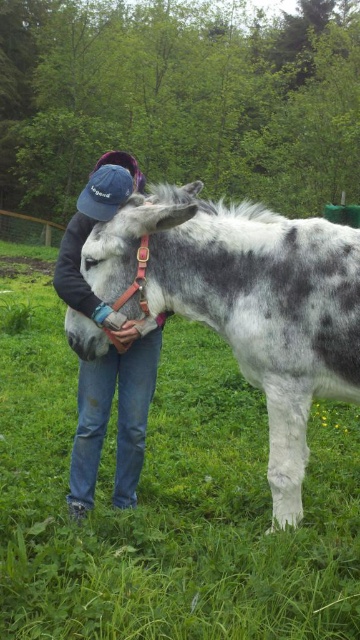
You are a photographer trying to capture a clear photo of the spotted fur mule at center and the denim cap at center. Since you want both subjects to be in focus, which one should you adjust your camera focus on first considering their sizes?

The spotted fur mule at center is larger in size than the denim cap at center, so you should focus on the spotted fur mule at center first to ensure both are in focus.

You are standing in the scene and want to take a photo of the donkey. There is a point at coordinates point (279,404) that is 8.52 feet away from you. If your camera has a focal length of 50mm and you want the donkey to fill the frame, which requires the subject to be 10 feet away, should you move closer or farther away from the point?

The point (279,404) is 8.52 feet away from you. To fill the frame with the donkey, you need to be 10 feet away. Therefore, you should move farther away from the point to increase the distance to 10 feet.